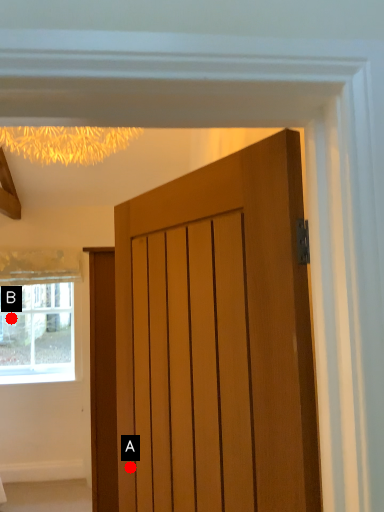
Question: Two points are circled on the image, labeled by A and B beside each circle. Which point is closer to the camera?

Choices:
 (A) A is closer
 (B) B is closer

Answer: (A)